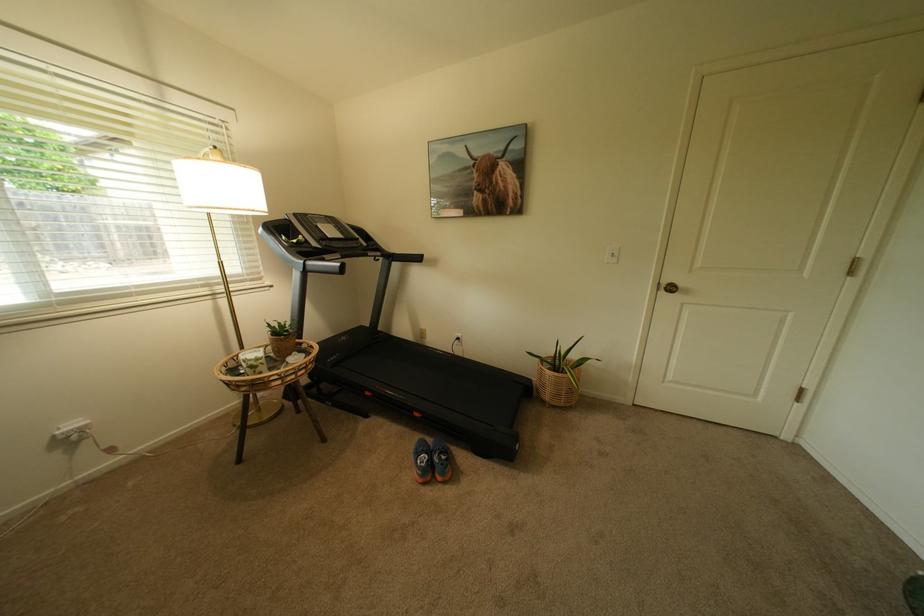
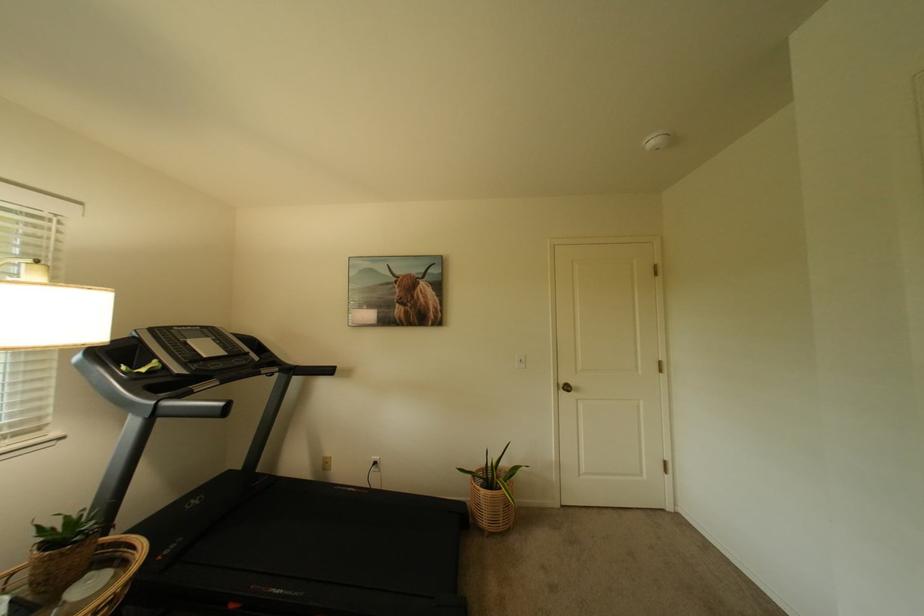
In the second image, find the point that corresponds to [296,363] in the first image.

(73, 605)